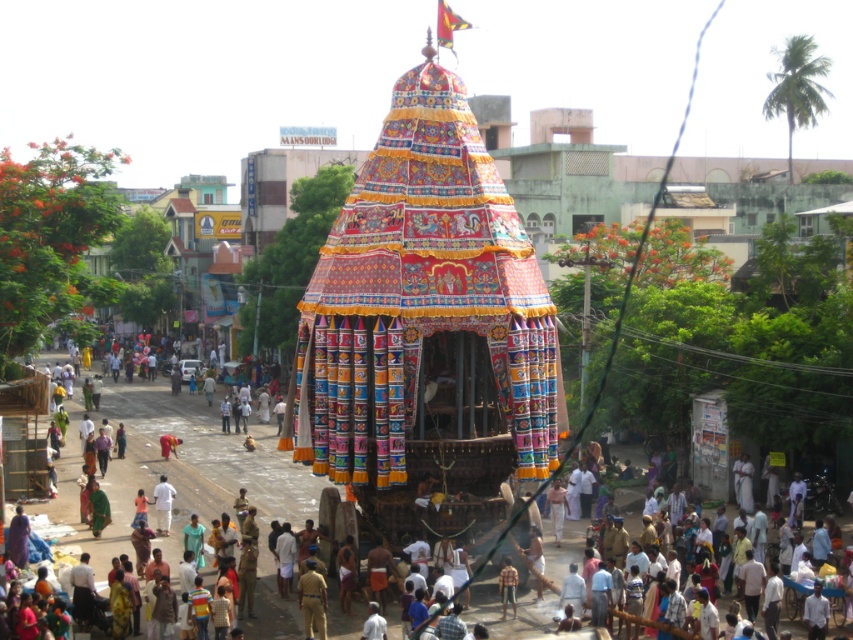
You are a photographer trying to capture a photo of the wooden cart at center and the striped shirt at center from the front. Based on their sizes, which one would appear wider in the photo?

The wooden cart at center appears wider in the photo because its width surpasses that of the striped shirt at center.

You are part of a crowd watching a festival procession. You see a wooden cart at center and a striped shirt at center. Which object is positioned to the left?

The wooden cart at center is to the left of the striped shirt at center, so the wooden cart at center is positioned to the left.